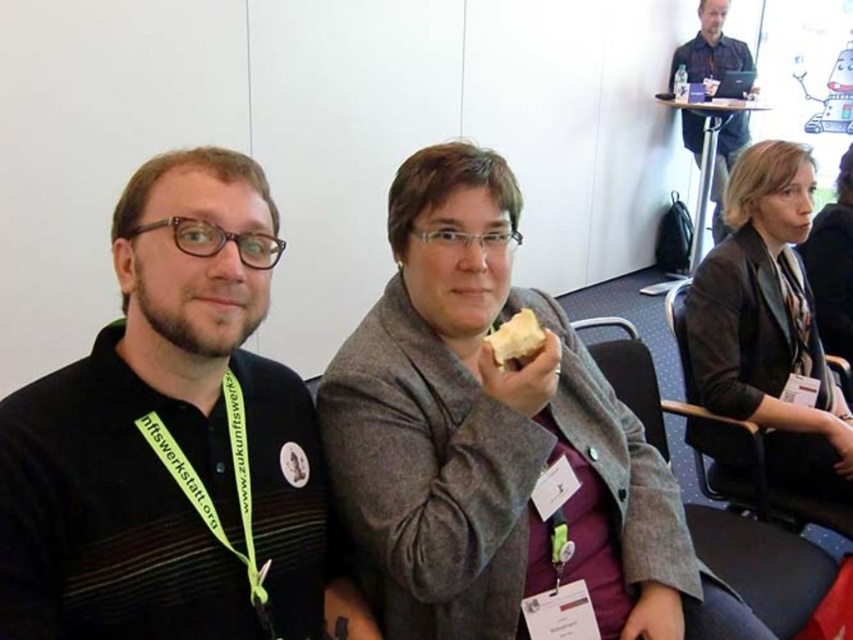
You are a photographer trying to capture a closeup of the gray woolen coat at center and the matte black shirt at upper center. Which object should you focus on first to ensure it appears sharp in the photo?

The gray woolen coat at center should be focused on first because it is closer to the viewer than the matte black shirt at upper center, ensuring it will be sharp when the photo is taken.

You are a photographer standing at the back of the room. You want to take a photo of the gray woolen coat at center and the matte black shirt at upper center. The camera you are using has a maximum focus range of 4 meters. Will both objects be in focus?

The gray woolen coat at center is 4.39 meters away from the matte black shirt at upper center. Since the camera has a maximum focus range of 4 meters, the distance between them exceeds this limit, so both objects cannot be in focus simultaneously.

What are the coordinates of the dark gray blazer at center?

The dark gray blazer at center is located at coordinates point (769, 324).